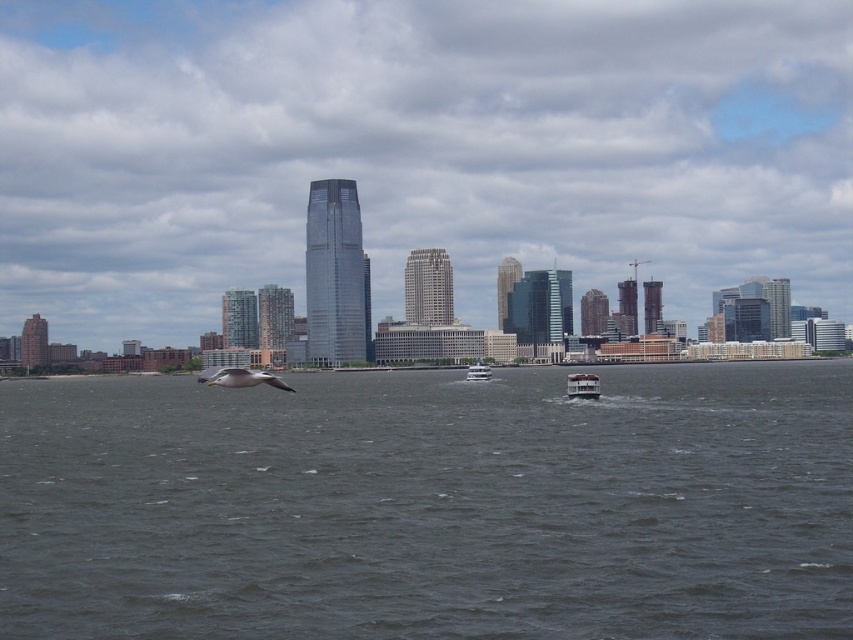
Between transparent glass skyscraper at center and gray water at center, which one has less height?

With less height is gray water at center.

Is transparent glass skyscraper at center thinner than gray water at center?

In fact, transparent glass skyscraper at center might be wider than gray water at center.

At what (x,y) coordinates should I click in order to perform the action: click on transparent glass skyscraper at center. Please return your answer as a coordinate pair (x, y). This screenshot has height=640, width=853. Looking at the image, I should click on (416, 148).

Which is more to the left, transparent glass skyscraper at center or white glossy ferry at center?

transparent glass skyscraper at center is more to the left.

Locate an element on the screen. transparent glass skyscraper at center is located at coordinates (416, 148).

Where is `transparent glass skyscraper at center`? Image resolution: width=853 pixels, height=640 pixels. transparent glass skyscraper at center is located at coordinates (416, 148).

Is transparent glass skyscraper at center to the left of white glossy boat at center from the viewer's perspective?

Indeed, transparent glass skyscraper at center is positioned on the left side of white glossy boat at center.

Who is shorter, transparent glass skyscraper at center or white glossy boat at center?

Standing shorter between the two is white glossy boat at center.

Describe the element at coordinates (416, 148) in the screenshot. I see `transparent glass skyscraper at center` at that location.

You are a GUI agent. You are given a task and a screenshot of the screen. Output one action in this format:
    pyautogui.click(x=<x>, y=<y>)
    Task: Click on the transparent glass skyscraper at center
    The height and width of the screenshot is (640, 853).
    Given the screenshot: What is the action you would take?
    pyautogui.click(x=416, y=148)